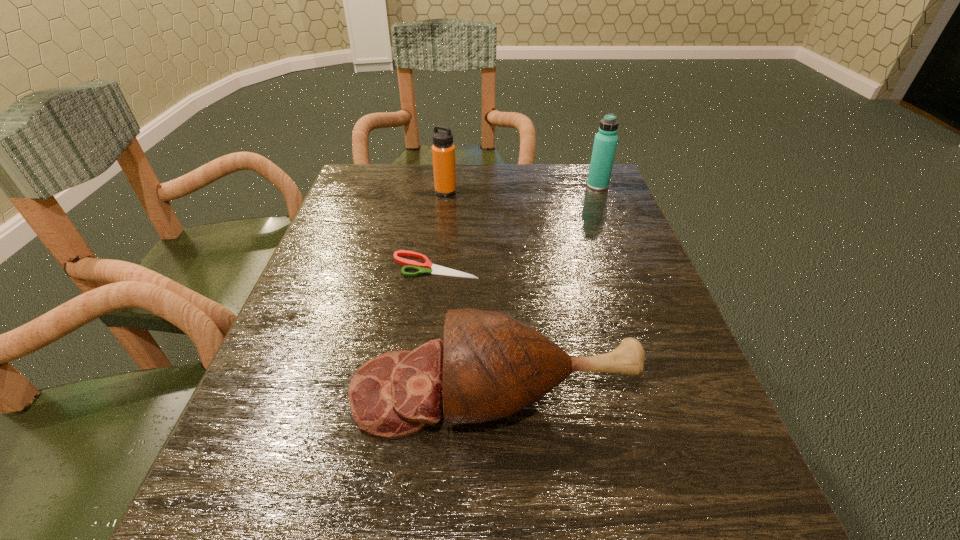
This screenshot has width=960, height=540. What are the coordinates of `vacant point that satisfies the following two spatial constraints: 1. on the back side of the rightmost object; 2. on the left side of the shortest object` in the screenshot? It's located at (444, 186).

Where is `blank space that satisfies the following two spatial constraints: 1. on the back side of the scissors; 2. on the left side of the right thermos bottle`? blank space that satisfies the following two spatial constraints: 1. on the back side of the scissors; 2. on the left side of the right thermos bottle is located at coordinates (444, 186).

This screenshot has width=960, height=540. What are the coordinates of `free location that satisfies the following two spatial constraints: 1. on the back side of the scissors; 2. on the right side of the left thermos bottle` in the screenshot? It's located at (444, 192).